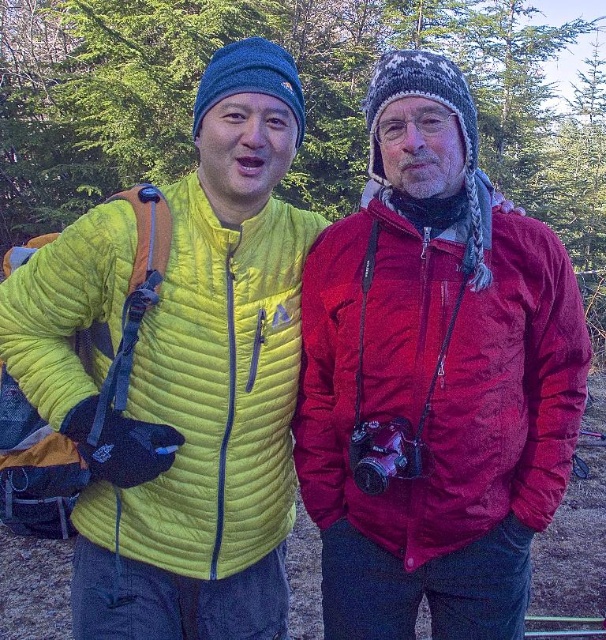
Who is taller, velvet red jacket at center or matte yellow jacket at left?

matte yellow jacket at left

Is velvet red jacket at center taller than matte yellow jacket at left?

No, velvet red jacket at center is not taller than matte yellow jacket at left.

Describe the element at coordinates (439, 376) in the screenshot. I see `velvet red jacket at center` at that location.

Identify the location of velvet red jacket at center. (439, 376).